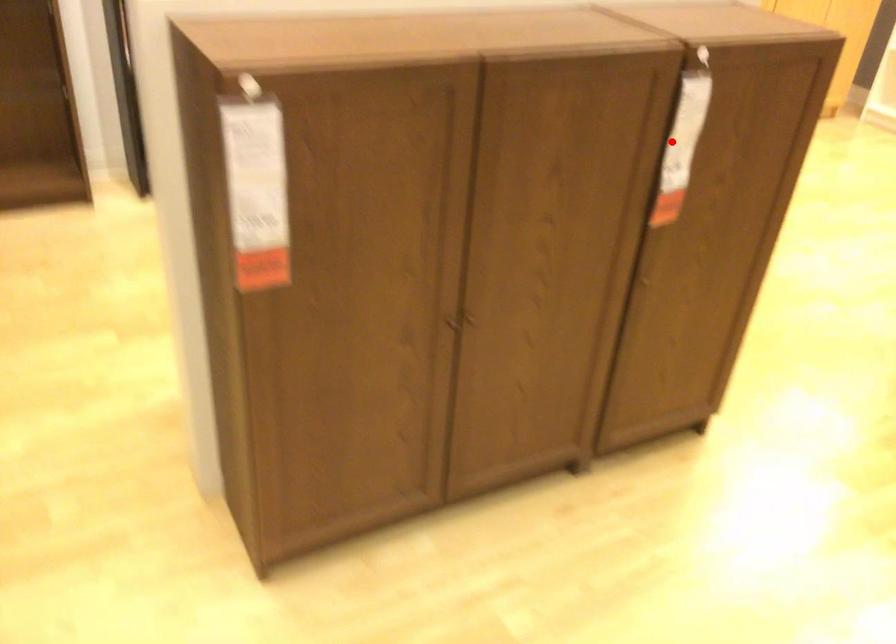
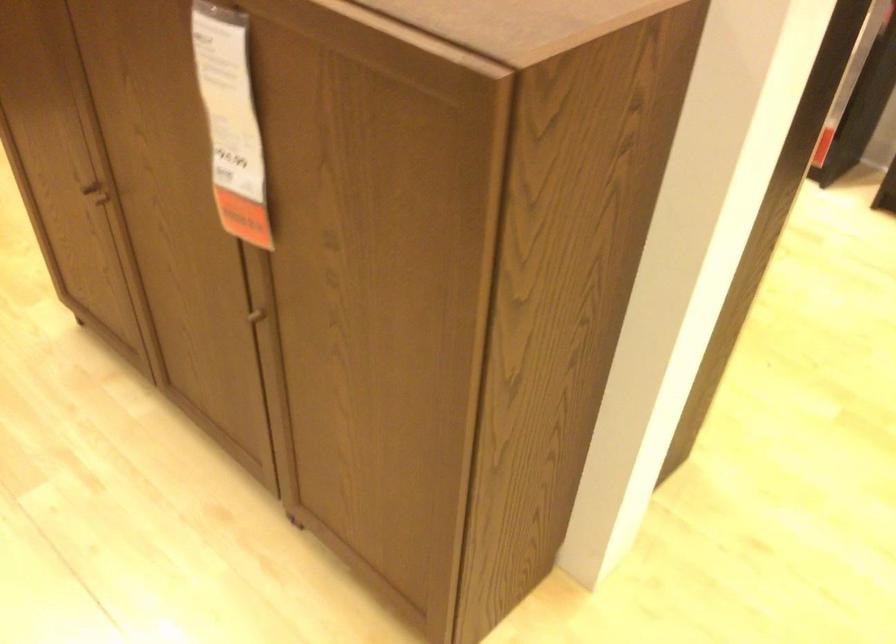
Question: I am providing you with two images of the same scene from different viewpoints. Given a red point in image1, look at the same physical point in image2. Is it:

Choices:
 (A) Closer to the viewpoint
 (B) Farther from the viewpoint

Answer: (A)